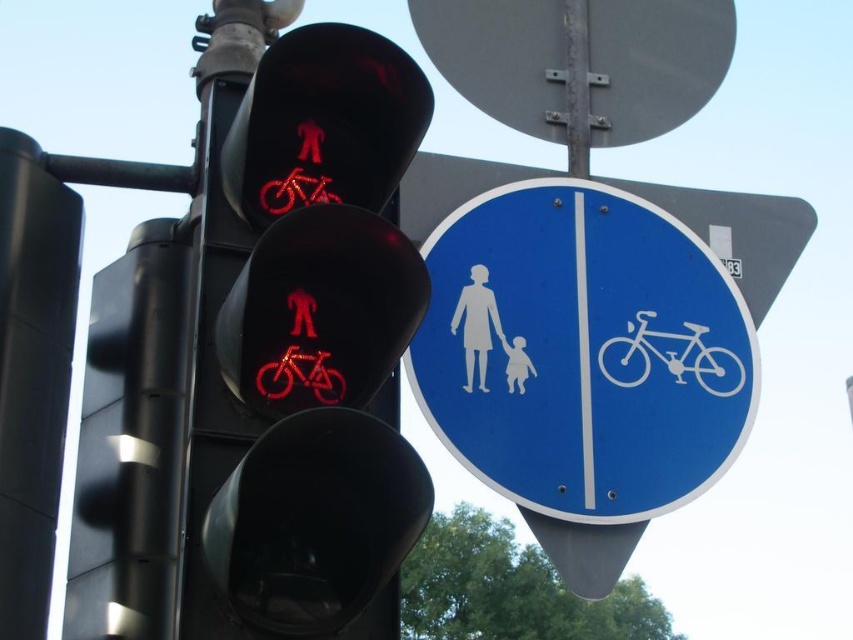
Between blue plastic bicycle at center and white matte bicycle at center, which one has more height?

Standing taller between the two is blue plastic bicycle at center.

Identify the location of blue plastic bicycle at center. The image size is (853, 640). (582, 352).

This screenshot has height=640, width=853. What are the coordinates of `blue plastic bicycle at center` in the screenshot? It's located at (582, 352).

Does point (376, 152) come closer to viewer compared to point (467, 381)?

Yes, it is.

Is point (248, 364) more distant than point (479, 328)?

No.

Identify the location of red matte pedestrian signal at upper left. (306, 342).

Is blue plastic bicycle at center above white matte figure at center?

Incorrect, blue plastic bicycle at center is not positioned above white matte figure at center.

Is point (555, 260) positioned in front of point (466, 323)?

No, (555, 260) is behind (466, 323).

Which is in front, point (619, 320) or point (466, 332)?

Positioned in front is point (466, 332).

Locate an element on the screen. blue plastic bicycle at center is located at coordinates (582, 352).